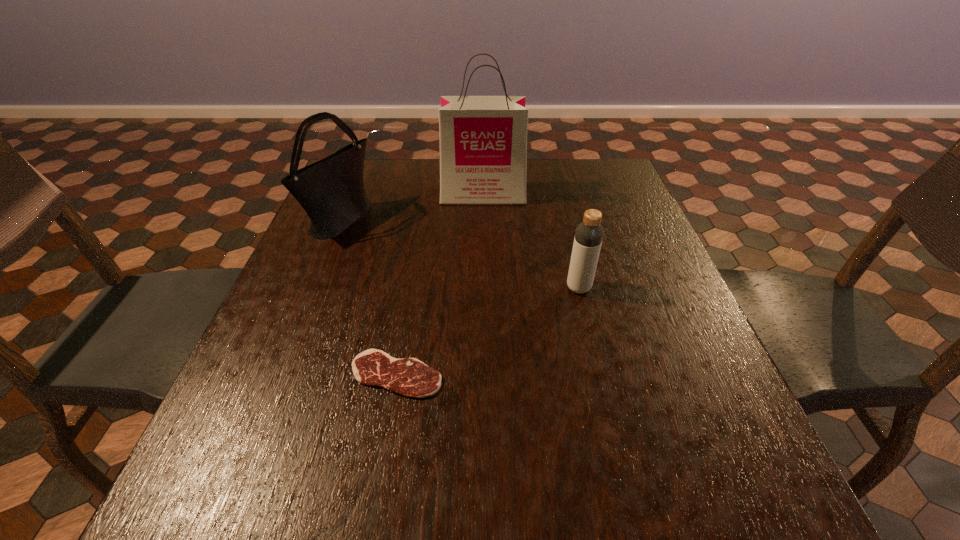
Identify the location of empty space that is in between the tallest object and the leftmost object. The image size is (960, 540). (412, 208).

Point out which object is positioned as the nearest to the third farthest object. Please provide its 2D coordinates. Your answer should be formatted as a tuple, i.e. [(x, y)], where the tuple contains the x and y coordinates of a point satisfying the conditions above.

[(409, 377)]

Identify which object is located as the third nearest to the shopping bag. Please provide its 2D coordinates. Your answer should be formatted as a tuple, i.e. [(x, y)], where the tuple contains the x and y coordinates of a point satisfying the conditions above.

[(409, 377)]

At what (x,y) coordinates should I click in order to perform the action: click on free region that satisfies the following two spatial constraints: 1. on the front side of the rightmost object; 2. on the left side of the second tallest object. Please return your answer as a coordinate pair (x, y). Looking at the image, I should click on (314, 288).

Where is `free spot that satisfies the following two spatial constraints: 1. on the front-facing side of the shopping bag; 2. on the left side of the bottle`? free spot that satisfies the following two spatial constraints: 1. on the front-facing side of the shopping bag; 2. on the left side of the bottle is located at coordinates (484, 288).

You are a GUI agent. You are given a task and a screenshot of the screen. Output one action in this format:
    pyautogui.click(x=<x>, y=<y>)
    Task: Click on the blank space that satisfies the following two spatial constraints: 1. on the front side of the shoulder bag; 2. on the right side of the rightmost object
    The image size is (960, 540).
    Given the screenshot: What is the action you would take?
    pyautogui.click(x=314, y=288)

Where is `vacant space that satisfies the following two spatial constraints: 1. on the front side of the nearest object; 2. on the left side of the second tallest object`? This screenshot has width=960, height=540. vacant space that satisfies the following two spatial constraints: 1. on the front side of the nearest object; 2. on the left side of the second tallest object is located at coordinates coord(279,374).